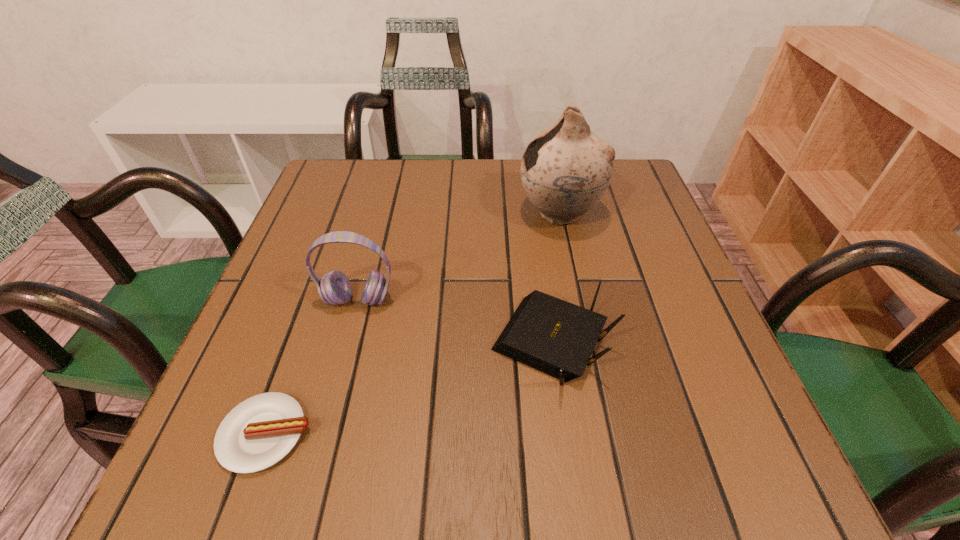
Identify the location of vacant space located 0.280m on the back of the sausage. (324, 272).

Find the location of a particular element. object that is positioned at the far edge is located at coordinates click(565, 170).

Find the location of a particular element. object that is at the near edge is located at coordinates (x=259, y=432).

Locate an element on the screen. The height and width of the screenshot is (540, 960). headset at the left edge is located at coordinates (334, 288).

Image resolution: width=960 pixels, height=540 pixels. Find the location of `sausage located in the left edge section of the desktop`. sausage located in the left edge section of the desktop is located at coordinates (259, 432).

Where is `object present at the right edge`? object present at the right edge is located at coordinates (565, 170).

The height and width of the screenshot is (540, 960). In order to click on object at the near left corner in this screenshot , I will do `click(259, 432)`.

This screenshot has height=540, width=960. In order to click on object that is at the far right corner in this screenshot , I will do `click(565, 170)`.

Locate an element on the screen. free location at the far edge is located at coordinates (394, 197).

The height and width of the screenshot is (540, 960). Find the location of `free spot at the near edge of the desktop`. free spot at the near edge of the desktop is located at coordinates (651, 448).